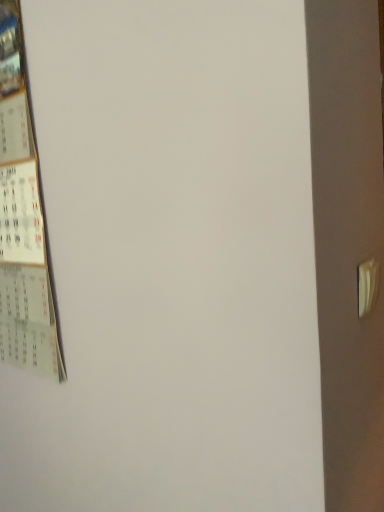
Where is `white paper calendar at left`? white paper calendar at left is located at coordinates (22, 221).

Image resolution: width=384 pixels, height=512 pixels. What do you see at coordinates (22, 221) in the screenshot? I see `white paper calendar at left` at bounding box center [22, 221].

Identify the location of white plastic door handle at right. The height and width of the screenshot is (512, 384). (367, 285).

The width and height of the screenshot is (384, 512). What do you see at coordinates (367, 285) in the screenshot? I see `white plastic door handle at right` at bounding box center [367, 285].

You are a GUI agent. You are given a task and a screenshot of the screen. Output one action in this format:
    pyautogui.click(x=<x>, y=<y>)
    Task: Click on the white paper calendar at left
    
    Given the screenshot: What is the action you would take?
    pyautogui.click(x=22, y=221)

Is white paper calendar at left at the right side of white plastic door handle at right?

No.

Does white paper calendar at left lie in front of white plastic door handle at right?

No, it is not.

Considering the points (15, 73) and (375, 280), which point is behind, point (15, 73) or point (375, 280)?

Point (15, 73)

From the image's perspective, which one is positioned higher, white paper calendar at left or white plastic door handle at right?

white paper calendar at left, from the image's perspective.

From a real-world perspective, is white paper calendar at left on white plastic door handle at right?

Yes, from a real-world perspective, white paper calendar at left is above white plastic door handle at right.

Is white paper calendar at left wider or thinner than white plastic door handle at right?

Clearly, white paper calendar at left has more width compared to white plastic door handle at right.

Considering the sizes of white paper calendar at left and white plastic door handle at right in the image, is white paper calendar at left taller or shorter than white plastic door handle at right?

Considering their sizes, white paper calendar at left has more height than white plastic door handle at right.

Considering the relative sizes of white paper calendar at left and white plastic door handle at right in the image provided, is white paper calendar at left bigger than white plastic door handle at right?

Correct, white paper calendar at left is larger in size than white plastic door handle at right.

From the picture: Do you think white paper calendar at left is within white plastic door handle at right, or outside of it?

white paper calendar at left is spatially situated outside white plastic door handle at right.

Is the surface of white paper calendar at left in direct contact with white plastic door handle at right?

white paper calendar at left is not next to white plastic door handle at right, and they're not touching.

Is white paper calendar at left facing away from white plastic door handle at right?

white paper calendar at left does not have its back to white plastic door handle at right.

Can you tell me how much white paper calendar at left and white plastic door handle at right differ in facing direction?

90 degrees.

The image size is (384, 512). I want to click on poster lying on the left of white plastic door handle at right, so click(22, 221).

Which is more to the left, white plastic door handle at right or white paper calendar at left?

white paper calendar at left is more to the left.

Is white plastic door handle at right positioned behind white paper calendar at left?

No, white plastic door handle at right is closer to the viewer.

Is point (364, 289) positioned before point (17, 251)?

That is True.

Based on the photo, from the image's perspective, which one is positioned lower, white plastic door handle at right or white paper calendar at left?

white plastic door handle at right is shown below in the image.

Consider the image. From a real-world perspective, is white plastic door handle at right over white paper calendar at left?

Incorrect, from a real-world perspective, white plastic door handle at right is lower than white paper calendar at left.

Looking at this image, does white plastic door handle at right have a greater width compared to white paper calendar at left?

→ No.

Between white plastic door handle at right and white paper calendar at left, which one has more height?

Standing taller between the two is white paper calendar at left.

Which of these two, white plastic door handle at right or white paper calendar at left, is smaller?

white plastic door handle at right is smaller.

Choose the correct answer: Is white plastic door handle at right inside white paper calendar at left or outside it?

white plastic door handle at right exists outside the volume of white paper calendar at left.

Is white plastic door handle at right far from white paper calendar at left?

They are positioned close to each other.

In the scene shown: Is white plastic door handle at right oriented away from white paper calendar at left?

Yes, white paper calendar at left is at the back of white plastic door handle at right.

What's the angular difference between white plastic door handle at right and white paper calendar at left's facing directions?

The facing directions of white plastic door handle at right and white paper calendar at left are 90 degrees apart.

Locate an element on the screen. door handle below the white paper calendar at left (from the image's perspective) is located at coordinates (367, 285).

In the image, there is a white paper calendar at left. Identify the location of door handle below it (from the image's perspective). (367, 285).

Where is `door handle on the right of white paper calendar at left`? This screenshot has height=512, width=384. door handle on the right of white paper calendar at left is located at coordinates (367, 285).